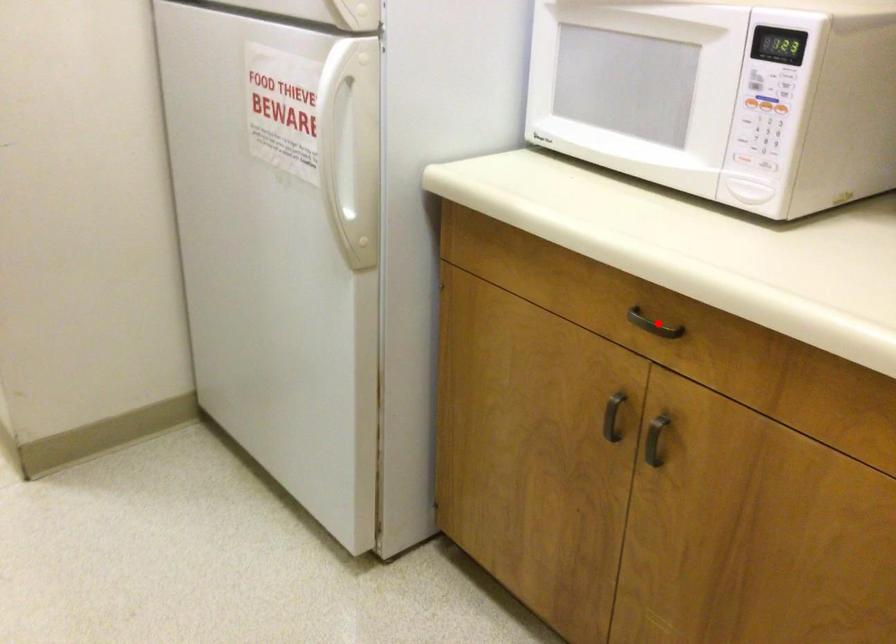
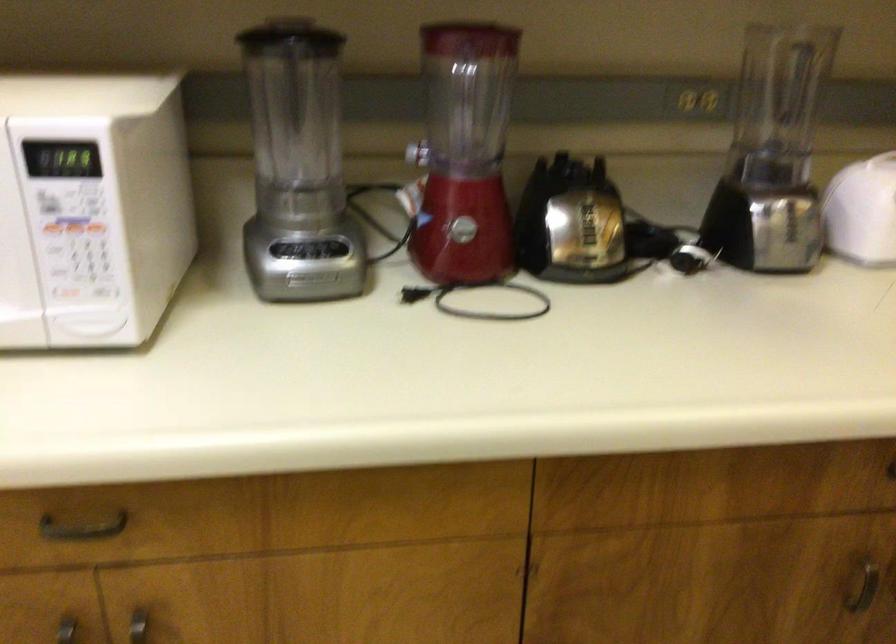
Question: A red point is marked in image1. In image2, is the corresponding 3D point closer to the camera or farther? Reply with the corresponding letter.

Choices:
 (A) The corresponding 3D point is closer.
 (B) The corresponding 3D point is farther.

Answer: (A)